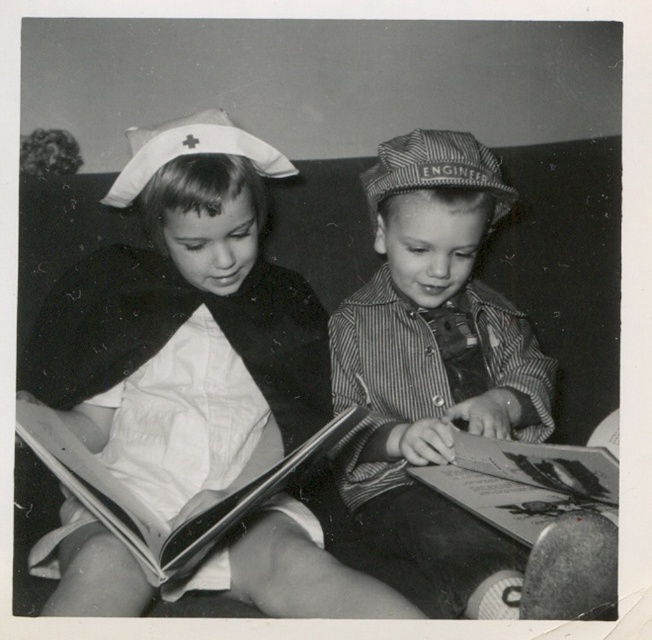
Question: Which of the following is the closest to the observer?

Choices:
 (A) (83, 509)
 (B) (173, 570)

Answer: (B)

Question: Which of the following is the farthest from the observer?

Choices:
 (A) white cloth dress at center
 (B) thick paper book at lower left
 (C) striped cotton shirt at center

Answer: (B)

Question: Is thick paper book at lower left thinner than paperboard book at lower center?

Choices:
 (A) yes
 (B) no

Answer: (B)

Question: Can you confirm if striped cotton shirt at center is positioned below paperboard book at lower center?

Choices:
 (A) yes
 (B) no

Answer: (B)

Question: Does white cloth dress at center appear on the right side of paperboard book at lower center?

Choices:
 (A) no
 (B) yes

Answer: (A)

Question: Which is nearer to the striped cotton shirt at center?

Choices:
 (A) white cloth dress at center
 (B) thick paper book at lower left

Answer: (A)